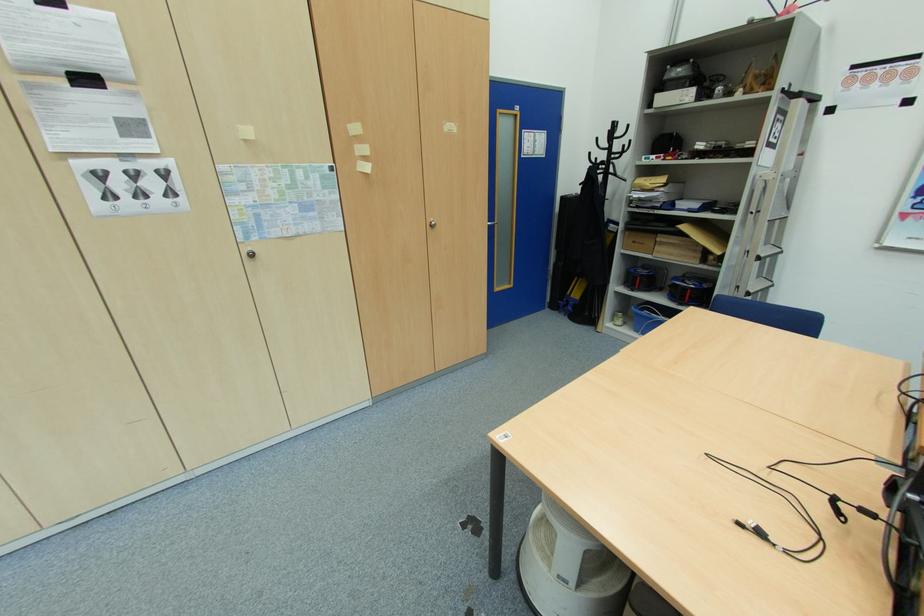
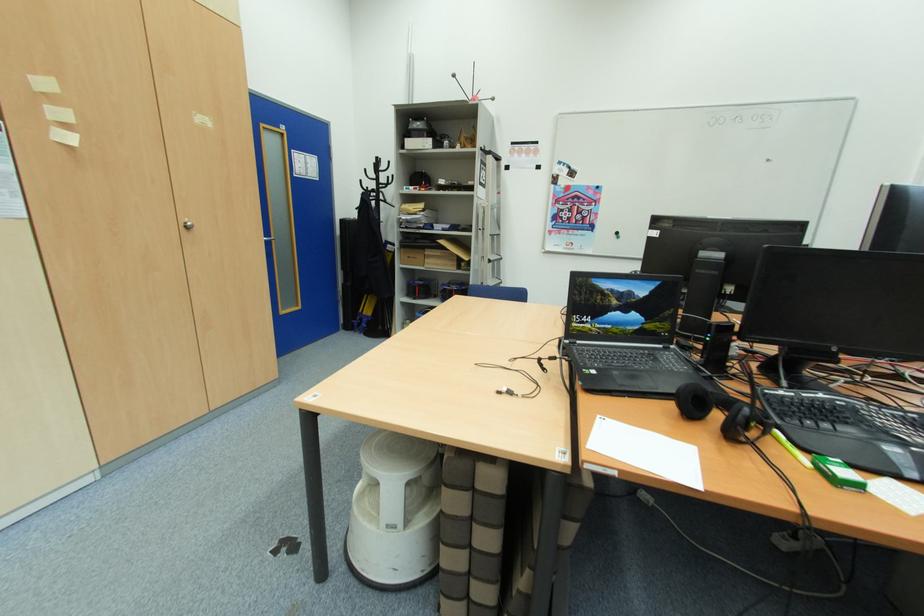
Question: The first image is from the beginning of the video and the second image is from the end. How did the camera likely rotate when shooting the video?

Choices:
 (A) Left
 (B) Right
 (C) Up
 (D) Down

Answer: (B)